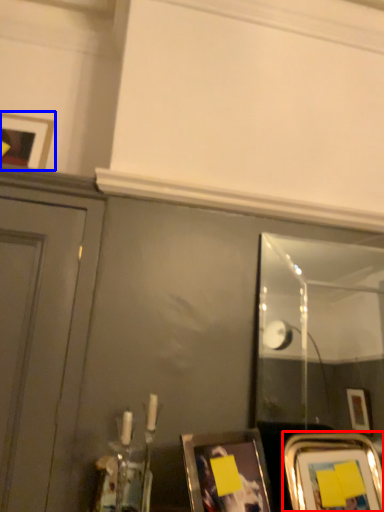
Question: Which object appears closest to the camera in this image, picture frame (highlighted by a red box) or picture frame (highlighted by a blue box)?

Choices:
 (A) picture frame
 (B) picture frame

Answer: (A)